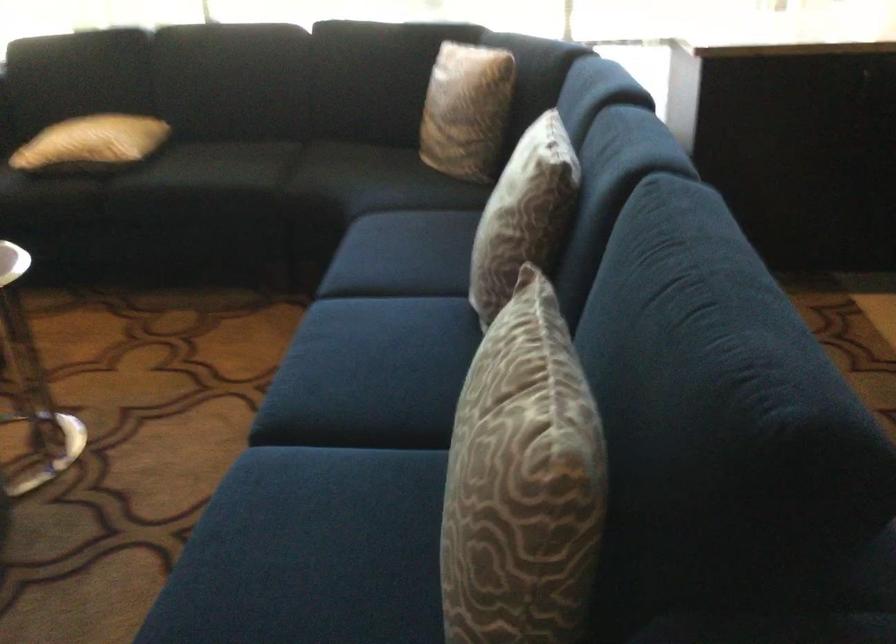
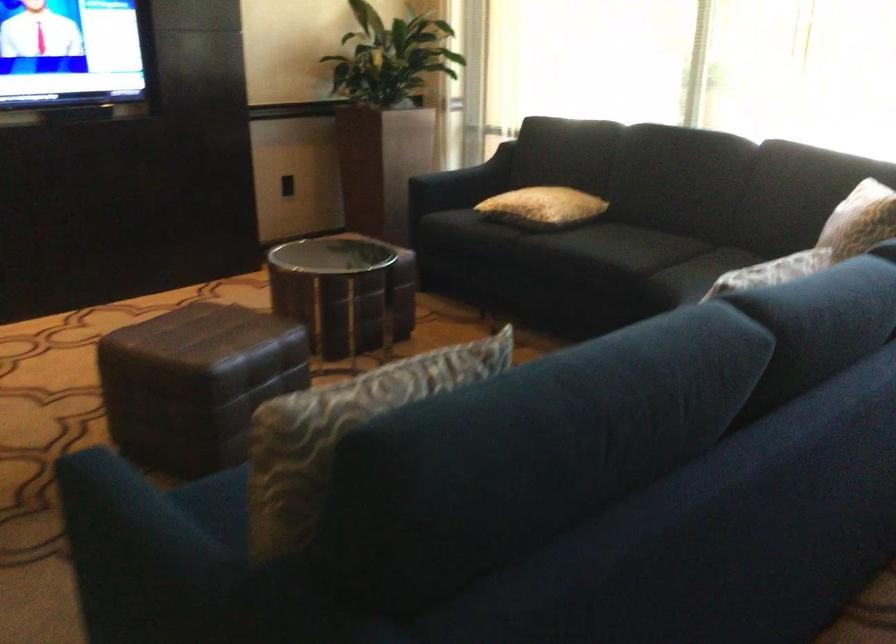
Question: I am providing you with two images of the same scene from different viewpoints. Which of the following objects are not visible in image2?

Choices:
 (A) sofa armrest
 (B) yellow patterned pillow
 (C) glass jar with contents
 (D) sofa sitting surface

Answer: (D)